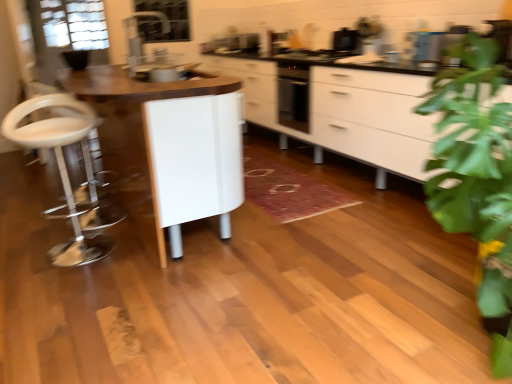
Question: Should I look upward or downward to see black glossy toaster at upper right?

Choices:
 (A) up
 (B) down

Answer: (A)

Question: Is transparent glass door at upper left bigger than white glossy cabinet at center?

Choices:
 (A) no
 (B) yes

Answer: (A)

Question: Does transparent glass door at upper left have a lesser width compared to white glossy cabinet at center?

Choices:
 (A) yes
 (B) no

Answer: (A)

Question: Is transparent glass door at upper left to the right of white glossy cabinet at center from the viewer's perspective?

Choices:
 (A) yes
 (B) no

Answer: (B)

Question: Could you tell me if transparent glass door at upper left is turned towards white glossy cabinet at center?

Choices:
 (A) yes
 (B) no

Answer: (B)

Question: Considering the relative sizes of transparent glass door at upper left and white glossy cabinet at center in the image provided, is transparent glass door at upper left taller than white glossy cabinet at center?

Choices:
 (A) yes
 (B) no

Answer: (B)

Question: Considering the relative sizes of transparent glass door at upper left and white glossy cabinet at center in the image provided, is transparent glass door at upper left smaller than white glossy cabinet at center?

Choices:
 (A) yes
 (B) no

Answer: (A)

Question: From a real-world perspective, is white glossy cabinet at center over clear glass window screen at upper center?

Choices:
 (A) no
 (B) yes

Answer: (A)

Question: Does white glossy cabinet at center have a greater width compared to clear glass window screen at upper center?

Choices:
 (A) no
 (B) yes

Answer: (B)

Question: Is white glossy cabinet at center not within clear glass window screen at upper center?

Choices:
 (A) yes
 (B) no

Answer: (A)

Question: Is white glossy cabinet at center at the left side of clear glass window screen at upper center?

Choices:
 (A) no
 (B) yes

Answer: (A)

Question: From the image's perspective, is white glossy cabinet at center on clear glass window screen at upper center?

Choices:
 (A) yes
 (B) no

Answer: (B)

Question: Can you confirm if white glossy cabinet at center is smaller than clear glass window screen at upper center?

Choices:
 (A) yes
 (B) no

Answer: (B)

Question: Is the depth of white glossy cabinet at center greater than that of transparent glass door at upper left?

Choices:
 (A) no
 (B) yes

Answer: (A)